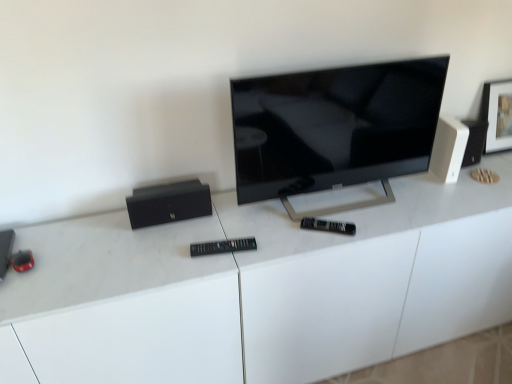
Question: Does black matte speaker at left, the 2th speaker from the left, have a larger size compared to black plastic remote at center?

Choices:
 (A) no
 (B) yes

Answer: (B)

Question: From the image's perspective, does black matte speaker at left, marked as the second speaker in a bottom-to-top arrangement, appear lower than black plastic remote at center?

Choices:
 (A) no
 (B) yes

Answer: (A)

Question: Is black plastic remote at center a part of black matte speaker at left, the 2th speaker from the left?

Choices:
 (A) yes
 (B) no

Answer: (B)

Question: Is black matte speaker at left, positioned as the 2th speaker in right-to-left order, turned away from black plastic remote at center?

Choices:
 (A) yes
 (B) no

Answer: (B)

Question: Is black matte speaker at left, marked as the second speaker in a bottom-to-top arrangement, placed right next to black plastic remote at center?

Choices:
 (A) yes
 (B) no

Answer: (B)

Question: From their relative heights in the image, would you say metallic black speaker at left, the 1th speaker when ordered from left to right, is taller or shorter than black plastic remote at center?

Choices:
 (A) short
 (B) tall

Answer: (A)

Question: From the image's perspective, is metallic black speaker at left, marked as the 3th speaker in a top-to-bottom arrangement, positioned above or below black plastic remote at center?

Choices:
 (A) below
 (B) above

Answer: (A)

Question: Does point (5, 273) appear closer or farther from the camera than point (247, 248)?

Choices:
 (A) farther
 (B) closer

Answer: (B)

Question: From a real-world perspective, is metallic black speaker at left, positioned as the 1th speaker in bottom-to-top order, positioned above or below black plastic remote at center?

Choices:
 (A) below
 (B) above

Answer: (A)

Question: From a real-world perspective, is black matte speaker at left, positioned as the 2th speaker in right-to-left order, positioned above or below white glossy desk at center?

Choices:
 (A) below
 (B) above

Answer: (B)

Question: Considering the positions of point (182, 215) and point (167, 375), is point (182, 215) closer or farther from the camera than point (167, 375)?

Choices:
 (A) closer
 (B) farther

Answer: (B)

Question: Is black matte speaker at left, acting as the 2th speaker starting from the top, wider or thinner than white glossy desk at center?

Choices:
 (A) thin
 (B) wide

Answer: (A)

Question: Do you think black matte speaker at left, marked as the second speaker in a bottom-to-top arrangement, is within white glossy desk at center, or outside of it?

Choices:
 (A) inside
 (B) outside

Answer: (B)

Question: From the image's perspective, is black matte speaker at left, the 2th speaker from the left, above or below black plastic remote at center?

Choices:
 (A) above
 (B) below

Answer: (A)

Question: Is black matte speaker at left, acting as the 2th speaker starting from the top, to the left or to the right of black plastic remote at center in the image?

Choices:
 (A) right
 (B) left

Answer: (B)